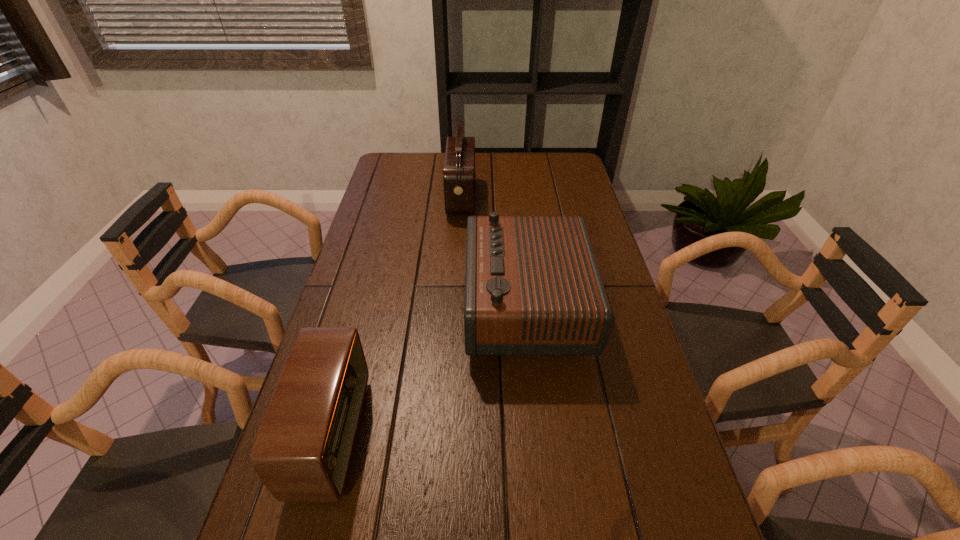
Where is `object that is at the left edge`? The height and width of the screenshot is (540, 960). object that is at the left edge is located at coordinates (302, 453).

Identify the location of object at the right edge. The image size is (960, 540). (532, 284).

Image resolution: width=960 pixels, height=540 pixels. Find the location of `vacant space at the left edge`. vacant space at the left edge is located at coordinates (371, 276).

Where is `vacant space at the right edge of the desktop`? The width and height of the screenshot is (960, 540). vacant space at the right edge of the desktop is located at coordinates (560, 192).

Where is `free space at the far right corner of the desktop`? free space at the far right corner of the desktop is located at coordinates (556, 160).

Identify the location of vacant region between the nearest radio receiver and the second farthest radio receiver. (429, 371).

Identify which object is located as the second nearest to the leftmost radio receiver. Please provide its 2D coordinates. Your answer should be formatted as a tuple, i.e. [(x, y)], where the tuple contains the x and y coordinates of a point satisfying the conditions above.

[(459, 177)]

The width and height of the screenshot is (960, 540). Identify the location of object that stands as the closest to the second nearest radio receiver. (459, 177).

Locate an element on the screen. the closest radio receiver to the leftmost object is located at coordinates click(532, 284).

Identify which radio receiver is located as the second nearest to the farthest radio receiver. Please provide its 2D coordinates. Your answer should be formatted as a tuple, i.e. [(x, y)], where the tuple contains the x and y coordinates of a point satisfying the conditions above.

[(302, 453)]